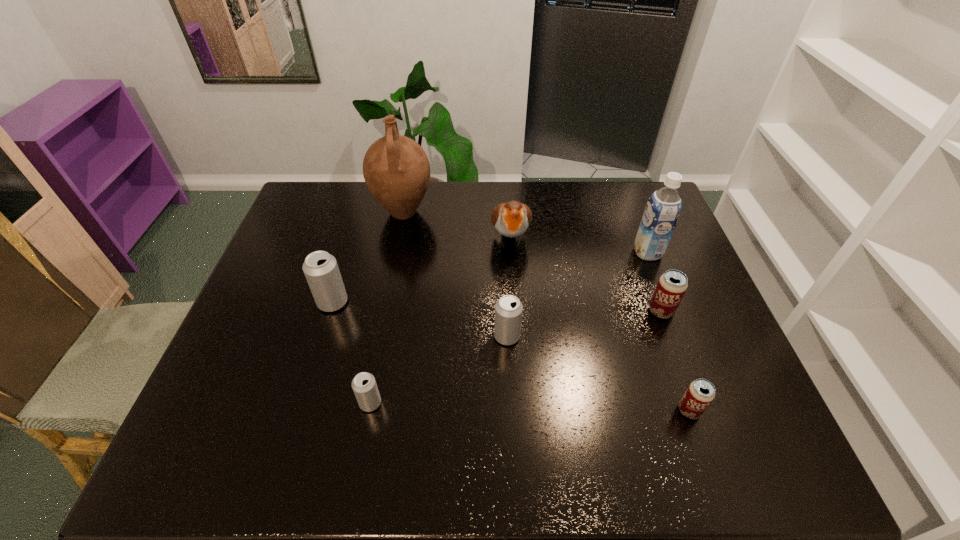
This screenshot has width=960, height=540. In order to click on the tallest object in this screenshot , I will do `click(396, 169)`.

Locate an element on the screen. brown pitcher is located at coordinates (396, 169).

The width and height of the screenshot is (960, 540). What are the coordinates of `the second tallest object` in the screenshot? It's located at (662, 211).

The height and width of the screenshot is (540, 960). I want to click on brown bird, so click(512, 219).

This screenshot has width=960, height=540. I want to click on the leftmost beer can, so (x=321, y=270).

Where is `the farthest white beer can`? This screenshot has height=540, width=960. the farthest white beer can is located at coordinates (321, 270).

Locate an element on the screen. the bigger red beer can is located at coordinates (672, 285).

The height and width of the screenshot is (540, 960). Find the location of `the sixth farthest object`. the sixth farthest object is located at coordinates (508, 309).

You are a GUI agent. You are given a task and a screenshot of the screen. Output one action in this format:
    pyautogui.click(x=<x>, y=<y>)
    Task: Click on the third beer can from right to left
    
    Given the screenshot: What is the action you would take?
    pyautogui.click(x=508, y=309)

Locate an element on the screen. The height and width of the screenshot is (540, 960). the smallest white beer can is located at coordinates click(364, 385).